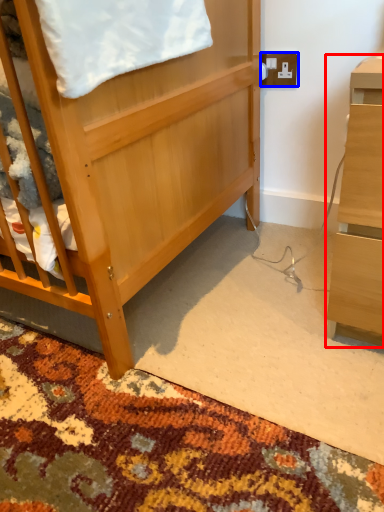
Question: Which object is further to the camera taking this photo, desk (highlighted by a red box) or electric outlet (highlighted by a blue box)?

Choices:
 (A) desk
 (B) electric outlet

Answer: (B)